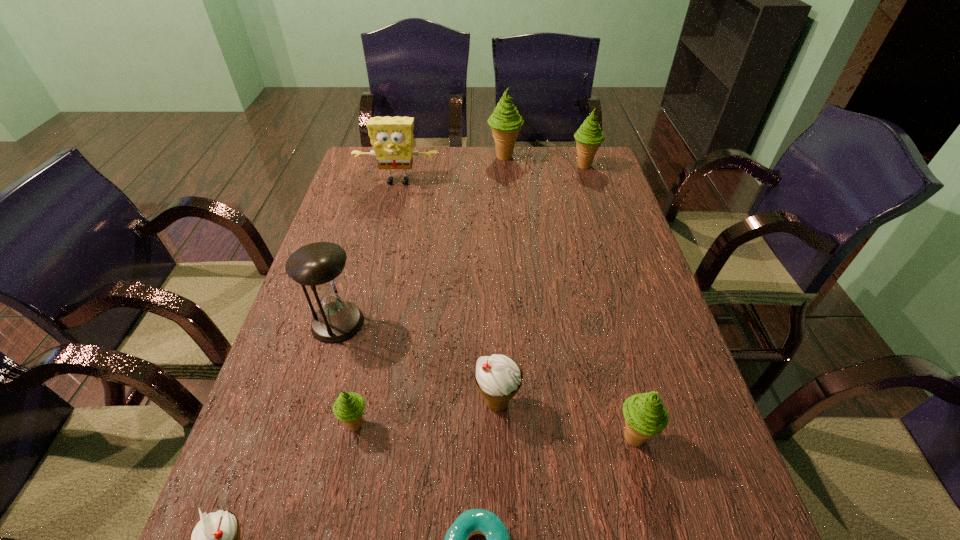
Where is `object located in the far left corner section of the desktop`? This screenshot has height=540, width=960. object located in the far left corner section of the desktop is located at coordinates (391, 137).

Where is `object at the far right corner`? The image size is (960, 540). object at the far right corner is located at coordinates (589, 136).

In order to click on vacant space at the far edge in this screenshot , I will do (474, 159).

I want to click on blank area at the left edge, so click(x=291, y=497).

You are a GUI agent. You are given a task and a screenshot of the screen. Output one action in this format:
    pyautogui.click(x=<x>, y=<y>)
    Task: Click on the vacant position at the right edge of the desktop
    
    Given the screenshot: What is the action you would take?
    pyautogui.click(x=603, y=187)

Where is `empty space between the biggest green icecream and the fifth shortest icecream`? The height and width of the screenshot is (540, 960). empty space between the biggest green icecream and the fifth shortest icecream is located at coordinates (544, 161).

In order to click on free space between the tallest icecream and the second biggest green icecream in this screenshot , I will do `click(544, 161)`.

Locate an element on the screen. The image size is (960, 540). free space between the sixth nearest object and the yellow sponge is located at coordinates (368, 252).

Where is `free point between the sponge and the right white icecream`? The image size is (960, 540). free point between the sponge and the right white icecream is located at coordinates (447, 292).

Where is `vacant point located between the biggest green icecream and the hourglass`? vacant point located between the biggest green icecream and the hourglass is located at coordinates (420, 240).